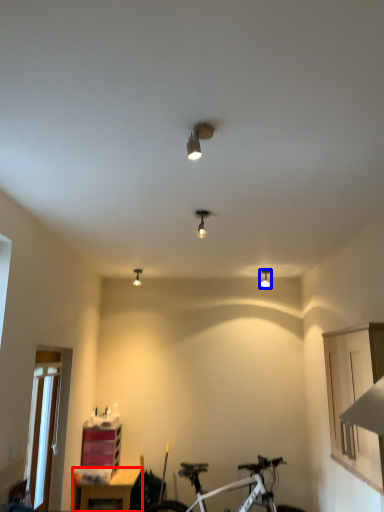
Question: Which object is closer to the camera taking this photo, table (highlighted by a red box) or light fixture (highlighted by a blue box)?

Choices:
 (A) table
 (B) light fixture

Answer: (A)